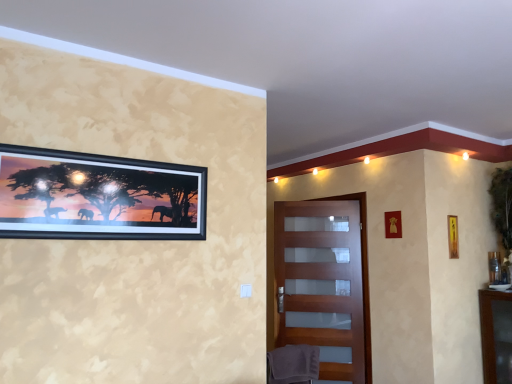
Question: Is metallic gold picture frame at upper right, which is the third picture frame in right-to-left order, directly adjacent to metallic gold picture frame at right, which is counted as the 1th picture frame, starting from the right?

Choices:
 (A) no
 (B) yes

Answer: (A)

Question: Is metallic gold picture frame at upper right, marked as the third picture frame in a front-to-back arrangement, closer to camera compared to metallic gold picture frame at right, positioned as the fourth picture frame in left-to-right order?

Choices:
 (A) yes
 (B) no

Answer: (A)

Question: Is metallic gold picture frame at upper right, the second picture frame in the back-to-front sequence, at the left side of metallic gold picture frame at right, which is counted as the 1th picture frame, starting from the right?

Choices:
 (A) yes
 (B) no

Answer: (A)

Question: Can you confirm if metallic gold picture frame at upper right, acting as the second picture frame starting from the left, is thinner than metallic gold picture frame at right, positioned as the fourth picture frame in left-to-right order?

Choices:
 (A) yes
 (B) no

Answer: (A)

Question: Would you say metallic gold picture frame at right, which is the fourth picture frame in front-to-back order, is part of metallic gold picture frame at upper right, marked as the third picture frame in a front-to-back arrangement,'s contents?

Choices:
 (A) yes
 (B) no

Answer: (B)

Question: Would you say wooden picture frame at upper right, acting as the 2th picture frame starting from the right, is inside or outside black matte picture frame at upper left, arranged as the first picture frame when viewed from the left?

Choices:
 (A) outside
 (B) inside

Answer: (A)

Question: Considering the positions of point (454, 228) and point (90, 210), is point (454, 228) closer or farther from the camera than point (90, 210)?

Choices:
 (A) farther
 (B) closer

Answer: (A)

Question: In the image, is wooden picture frame at upper right, placed as the 3th picture frame when sorted from left to right, on the left side or the right side of black matte picture frame at upper left, which appears as the fourth picture frame when viewed from the right?

Choices:
 (A) left
 (B) right

Answer: (B)

Question: In terms of width, does wooden picture frame at upper right, placed as the 3th picture frame when sorted from left to right, look wider or thinner when compared to black matte picture frame at upper left, which appears as the fourth picture frame when viewed from the right?

Choices:
 (A) thin
 (B) wide

Answer: (A)

Question: Looking at their shapes, would you say gray fabric swivel chair at lower center is wider or thinner than matte wooden door at center?

Choices:
 (A) wide
 (B) thin

Answer: (A)

Question: Considering the positions of point (295, 350) and point (353, 216), is point (295, 350) closer or farther from the camera than point (353, 216)?

Choices:
 (A) farther
 (B) closer

Answer: (B)

Question: Considering the positions of gray fabric swivel chair at lower center and matte wooden door at center in the image, is gray fabric swivel chair at lower center taller or shorter than matte wooden door at center?

Choices:
 (A) short
 (B) tall

Answer: (A)

Question: Considering their positions, is gray fabric swivel chair at lower center located in front of or behind matte wooden door at center?

Choices:
 (A) front
 (B) behind

Answer: (A)

Question: In the image, is matte wooden door at center on the left side or the right side of wooden picture frame at upper right, acting as the 2th picture frame starting from the right?

Choices:
 (A) right
 (B) left

Answer: (B)

Question: Does point (313, 316) appear closer or farther from the camera than point (457, 254)?

Choices:
 (A) farther
 (B) closer

Answer: (A)